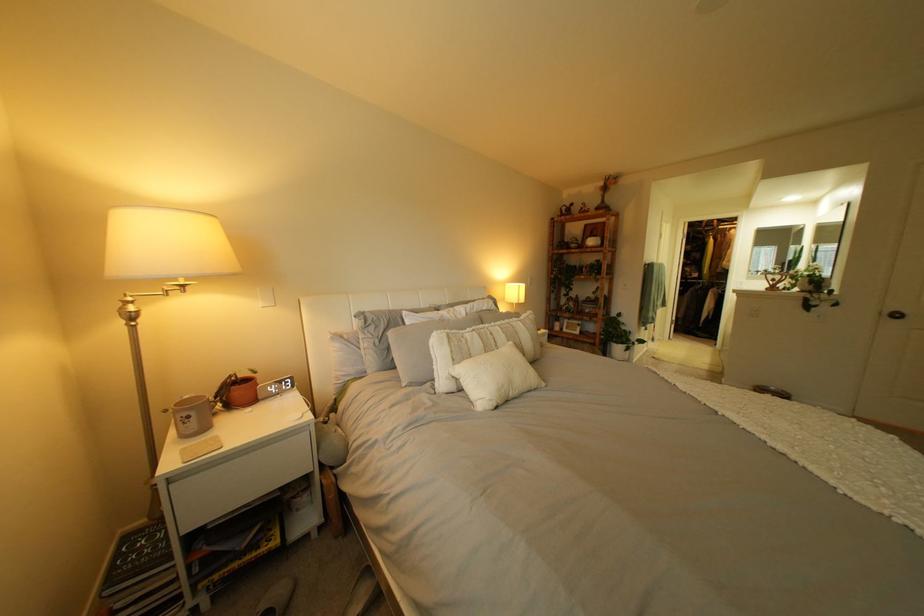
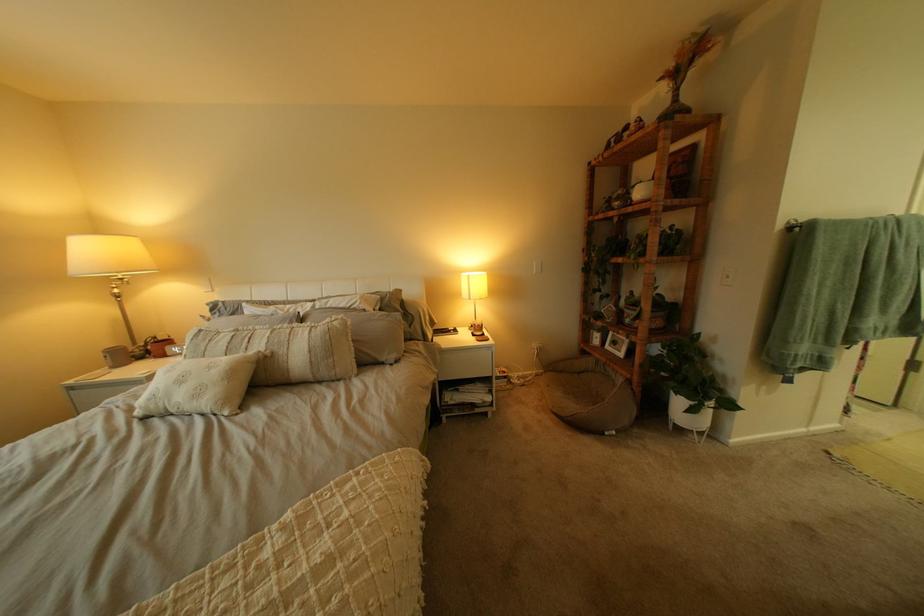
In the second image, find the point that corresponds to point 629,341 in the first image.

(687, 385)